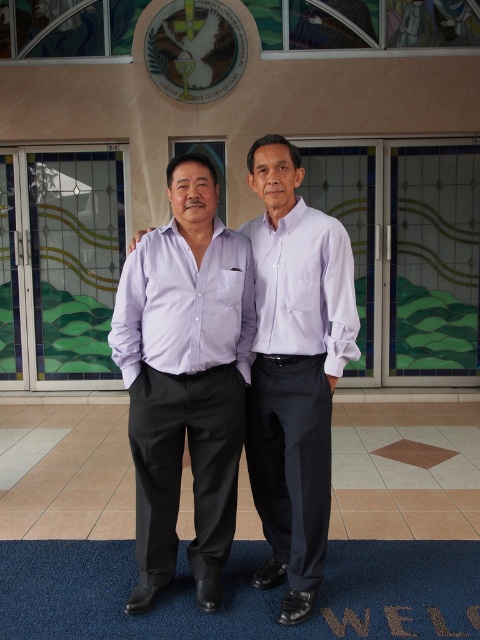
Question: Which object is the farthest from the blue carpet at lower center?

Choices:
 (A) lavender cotton shirt at center
 (B) white smooth shirt at center
 (C) matte purple shirt at center

Answer: (B)

Question: Is matte purple shirt at center closer to the viewer compared to white smooth shirt at center?

Choices:
 (A) yes
 (B) no

Answer: (A)

Question: Is matte purple shirt at center thinner than white smooth shirt at center?

Choices:
 (A) yes
 (B) no

Answer: (A)

Question: Estimate the real-world distances between objects in this image. Which object is closer to the blue carpet at lower center?

Choices:
 (A) matte purple shirt at center
 (B) white smooth shirt at center
 (C) lavender cotton shirt at center

Answer: (A)

Question: Is lavender cotton shirt at center to the left of white smooth shirt at center from the viewer's perspective?

Choices:
 (A) no
 (B) yes

Answer: (B)

Question: Which point appears closest to the camera in this image?

Choices:
 (A) (290, 284)
 (B) (180, 360)

Answer: (B)